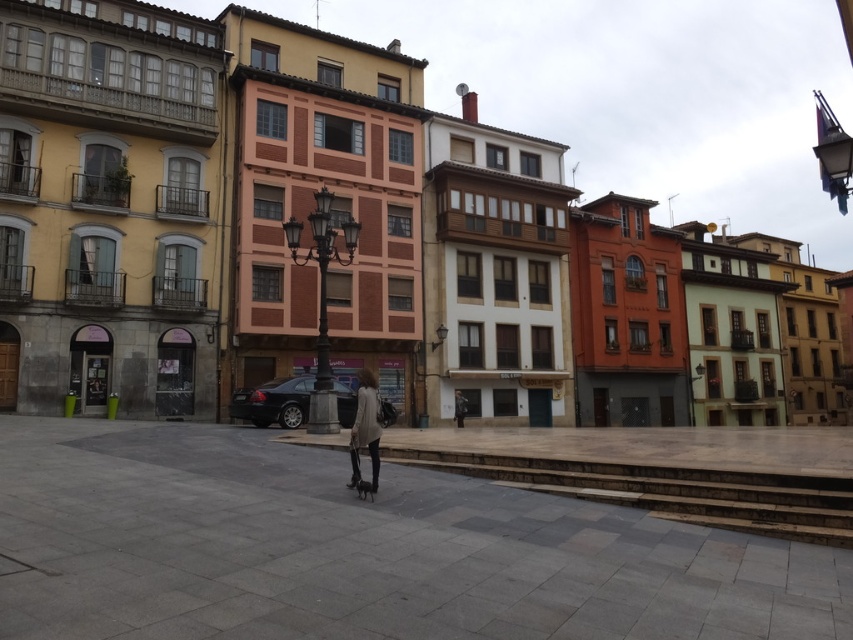
Can you confirm if light beige sweater at center is taller than dark gray fabric jacket at center?

Correct, light beige sweater at center is much taller as dark gray fabric jacket at center.

Is point (363, 371) less distant than point (457, 403)?

Yes.

Is point (358, 444) less distant than point (456, 401)?

Yes.

Identify the location of light beige sweater at center. Image resolution: width=853 pixels, height=640 pixels. (364, 428).